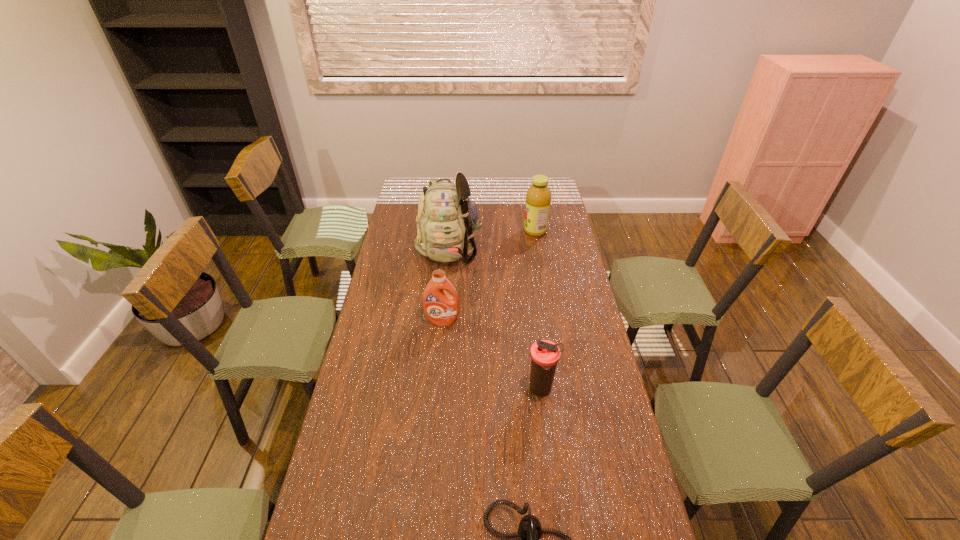
This screenshot has height=540, width=960. I want to click on object located in the left edge section of the desktop, so click(447, 219).

Where is `object that is at the right edge`? Image resolution: width=960 pixels, height=540 pixels. object that is at the right edge is located at coordinates (538, 197).

Locate an element on the screen. The height and width of the screenshot is (540, 960). vacant space at the far edge of the desktop is located at coordinates (519, 190).

Where is `vacant area at the left edge of the desktop`? vacant area at the left edge of the desktop is located at coordinates (396, 279).

What are the coordinates of `vacant space at the right edge` in the screenshot? It's located at (583, 445).

Locate which object ranks in proximity to the fourth farthest object. Please provide its 2D coordinates. Your answer should be formatted as a tuple, i.e. [(x, y)], where the tuple contains the x and y coordinates of a point satisfying the conditions above.

[(530, 531)]

Image resolution: width=960 pixels, height=540 pixels. In order to click on the third closest object relative to the nearest object in this screenshot , I will do `click(447, 219)`.

This screenshot has height=540, width=960. Find the location of `vacant space that satisfies the following two spatial constraints: 1. on the front-facing side of the third farthest object; 2. on the left side of the thermos bottle`. vacant space that satisfies the following two spatial constraints: 1. on the front-facing side of the third farthest object; 2. on the left side of the thermos bottle is located at coordinates (436, 389).

Find the location of a particular element. The width and height of the screenshot is (960, 540). free space that satisfies the following two spatial constraints: 1. on the front label of the fruit juice; 2. on the front-facing side of the third nearest object is located at coordinates (550, 321).

Find the location of `free location that satisfies the following two spatial constraints: 1. on the front-facing side of the detergent; 2. on the left side of the thermos bottle`. free location that satisfies the following two spatial constraints: 1. on the front-facing side of the detergent; 2. on the left side of the thermos bottle is located at coordinates (436, 389).